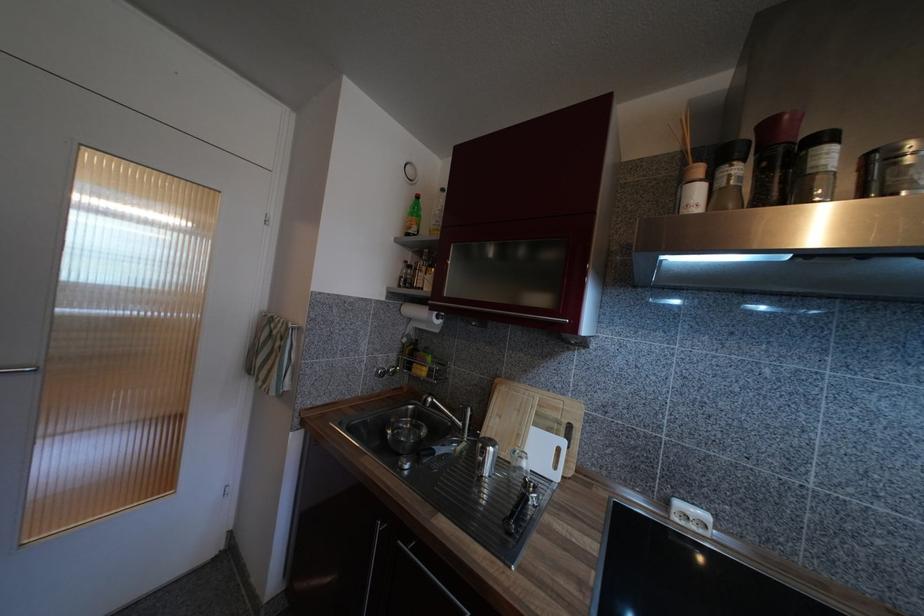
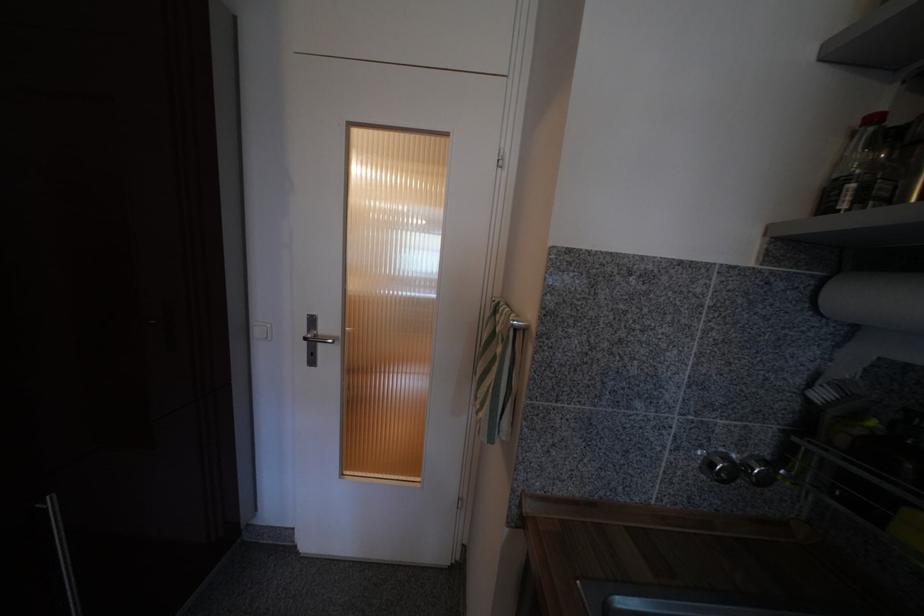
Find the pixel in the second image that matches pixel 409 264 in the first image.

(879, 121)